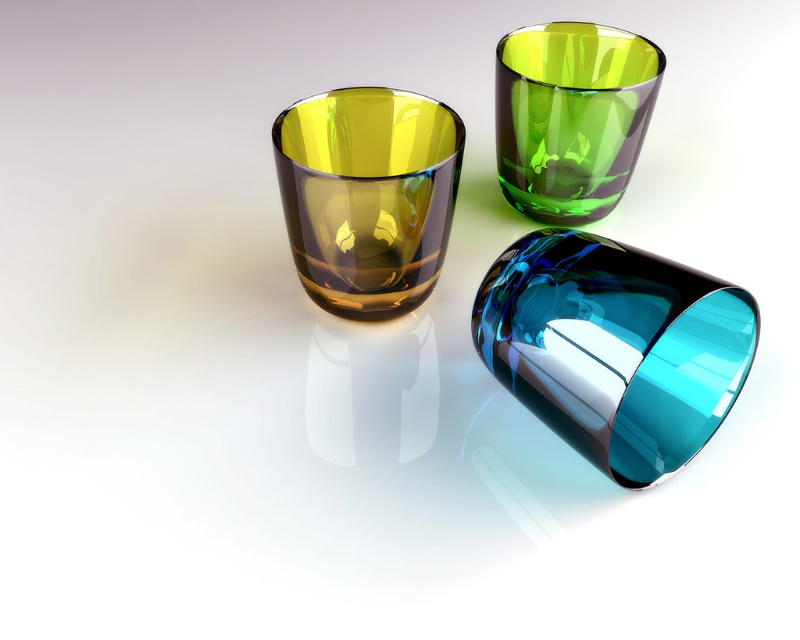
You are organizing a small gathering and need to place a decorative item between the amber glass at center and the green translucent glass at upper center. Considering their widths, which cup should be placed closer to the narrower side to maintain balance?

The amber glass at center is narrower than the green translucent glass at upper center. To maintain balance, place the decorative item closer to the amber glass at center so that the wider green translucent glass at upper center can counterbalance it on the other side.

You are arranging drinks for a party and need to place a new cup between the translucent blue glass at lower right and the amber glass at center. Based on their positions, which cup should you place closer to the front of the table?

The translucent blue glass at lower right is closer to the viewer than the amber glass at center, so you should place the new cup closer to the front of the table near the translucent blue glass at lower right.

You are setting up a table for a party and need to arrange the translucent blue glass at lower right and the amber glass at center. Which glass should you place in a spot where height matters, like under a low shelf?

The amber glass at center is taller than the translucent blue glass at lower right, so it should be placed in a spot where height matters, such as under a low shelf, to ensure it fits properly.